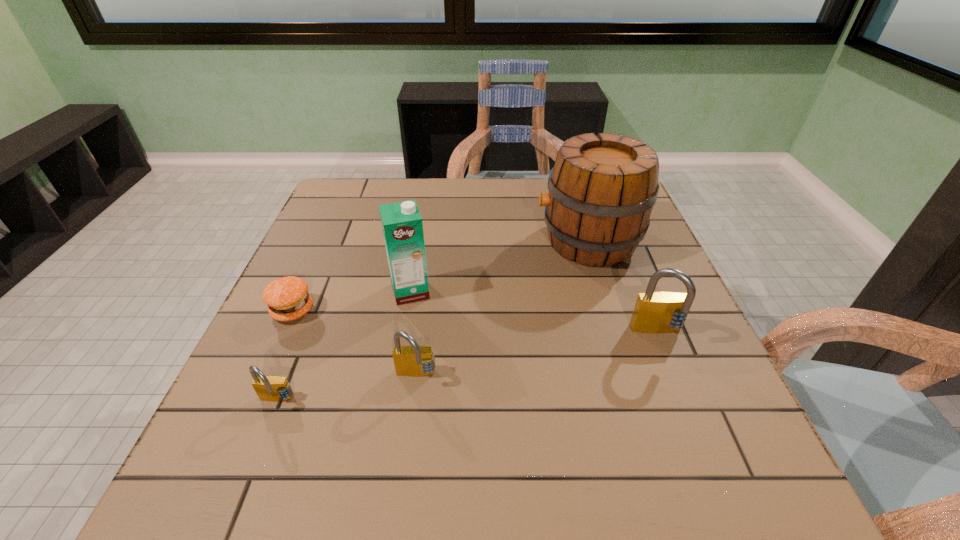
This screenshot has height=540, width=960. Identify the location of patty that is at the left edge. (287, 298).

At what (x,y) coordinates should I click in order to perform the action: click on padlock present at the right edge. Please return your answer as a coordinate pair (x, y). This screenshot has width=960, height=540. Looking at the image, I should click on (655, 312).

At what (x,y) coordinates should I click in order to perform the action: click on cider that is at the right edge. Please return your answer as a coordinate pair (x, y). Looking at the image, I should click on (602, 189).

You are a GUI agent. You are given a task and a screenshot of the screen. Output one action in this format:
    pyautogui.click(x=<x>, y=<y>)
    Task: Click on the object that is at the near left corner
    
    Given the screenshot: What is the action you would take?
    pyautogui.click(x=268, y=388)

Locate an element on the screen. This screenshot has height=540, width=960. object situated at the far right corner is located at coordinates (602, 189).

The height and width of the screenshot is (540, 960). I want to click on free region at the far edge, so click(x=398, y=195).

This screenshot has width=960, height=540. In order to click on free space at the near edge of the desktop in this screenshot , I will do `click(537, 417)`.

You are a GUI agent. You are given a task and a screenshot of the screen. Output one action in this format:
    pyautogui.click(x=<x>, y=<y>)
    Task: Click on the free space at the left edge of the desktop
    
    Given the screenshot: What is the action you would take?
    tap(266, 357)

Where is `vacant area at the right edge`? This screenshot has width=960, height=540. vacant area at the right edge is located at coordinates (618, 266).

At what (x,y) coordinates should I click in order to perform the action: click on vacant space at the near left corner of the desktop. Please return your answer as a coordinate pair (x, y). The image size is (960, 540). Looking at the image, I should click on (240, 414).